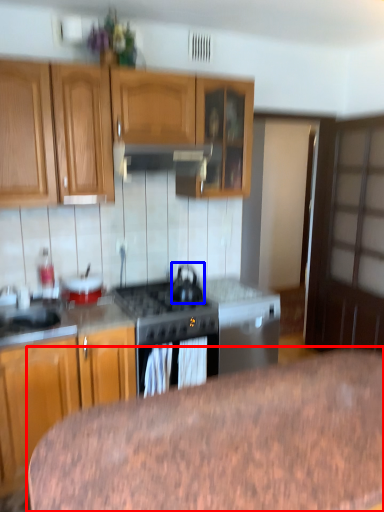
Question: Which object is further to the camera taking this photo, table (highlighted by a red box) or kitchen appliance (highlighted by a blue box)?

Choices:
 (A) table
 (B) kitchen appliance

Answer: (B)